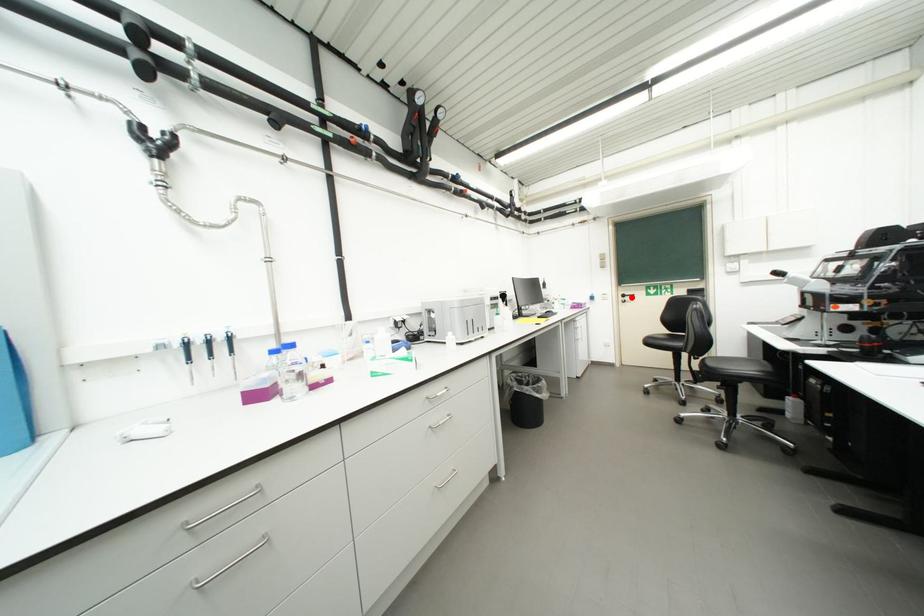
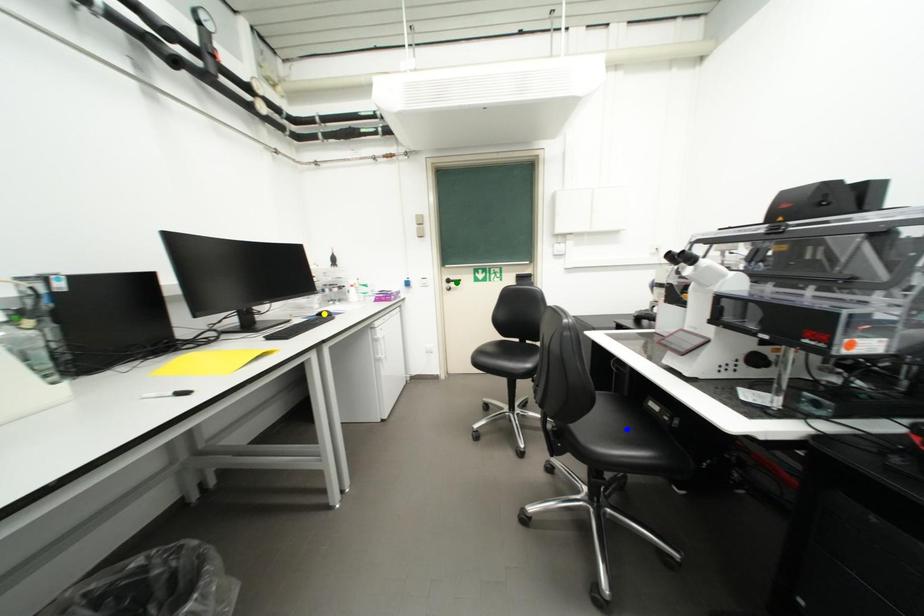
Question: I am providing you with two images of the same scene from different viewpoints. A red point is marked on the first image. You are given multiple points on the second image. Which point in image 2 is actually the same real-world point as the red point in image 1?

Choices:
 (A) yellow point
 (B) blue point
 (C) green point

Answer: (C)